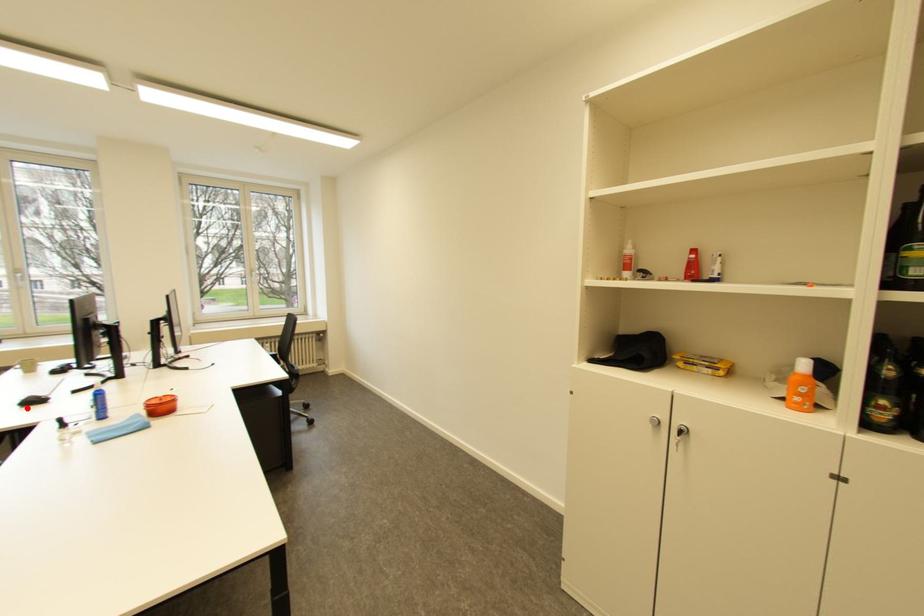
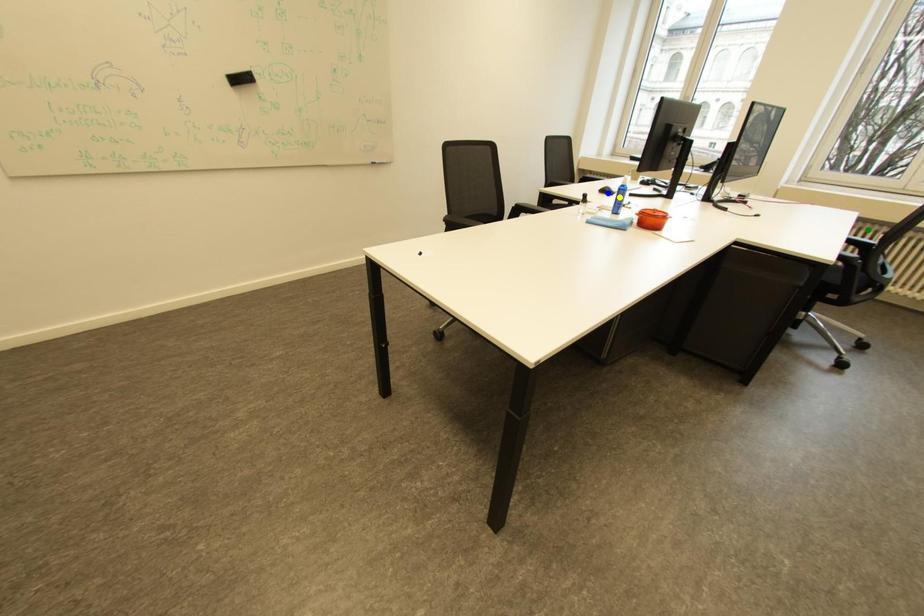
Question: I am providing you with two images of the same scene from different viewpoints. A red point is marked on the first image. You are given multiple points on the second image. Which point in image 2 represents the same 3d spot as the red point in image 1?

Choices:
 (A) blue point
 (B) yellow point
 (C) green point

Answer: (A)